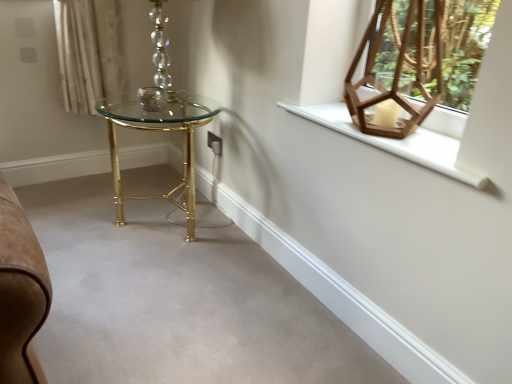
Question: Considering the relative sizes of matte glass candle holder at center and white wooden window sill at upper right in the image provided, is matte glass candle holder at center bigger than white wooden window sill at upper right?

Choices:
 (A) yes
 (B) no

Answer: (B)

Question: From the image's perspective, is matte glass candle holder at center under white wooden window sill at upper right?

Choices:
 (A) no
 (B) yes

Answer: (A)

Question: From a real-world perspective, is matte glass candle holder at center on white wooden window sill at upper right?

Choices:
 (A) no
 (B) yes

Answer: (A)

Question: Can you confirm if matte glass candle holder at center is shorter than white wooden window sill at upper right?

Choices:
 (A) no
 (B) yes

Answer: (A)

Question: Does matte glass candle holder at center turn towards white wooden window sill at upper right?

Choices:
 (A) yes
 (B) no

Answer: (B)

Question: Does matte glass candle holder at center have a smaller size compared to white wooden window sill at upper right?

Choices:
 (A) yes
 (B) no

Answer: (A)

Question: Is gold metallic table at center taller than wooden hexagonal lantern at upper right?

Choices:
 (A) yes
 (B) no

Answer: (A)

Question: From the image's perspective, is gold metallic table at center above wooden hexagonal lantern at upper right?

Choices:
 (A) no
 (B) yes

Answer: (A)

Question: Can you confirm if gold metallic table at center is bigger than wooden hexagonal lantern at upper right?

Choices:
 (A) no
 (B) yes

Answer: (B)

Question: Can you confirm if gold metallic table at center is smaller than wooden hexagonal lantern at upper right?

Choices:
 (A) yes
 (B) no

Answer: (B)

Question: Would you say wooden hexagonal lantern at upper right is part of gold metallic table at center's contents?

Choices:
 (A) yes
 (B) no

Answer: (B)

Question: Does gold metallic table at center have a lesser width compared to wooden hexagonal lantern at upper right?

Choices:
 (A) no
 (B) yes

Answer: (A)

Question: Does gold metallic table at center lie behind matte glass candle holder at center?

Choices:
 (A) yes
 (B) no

Answer: (B)